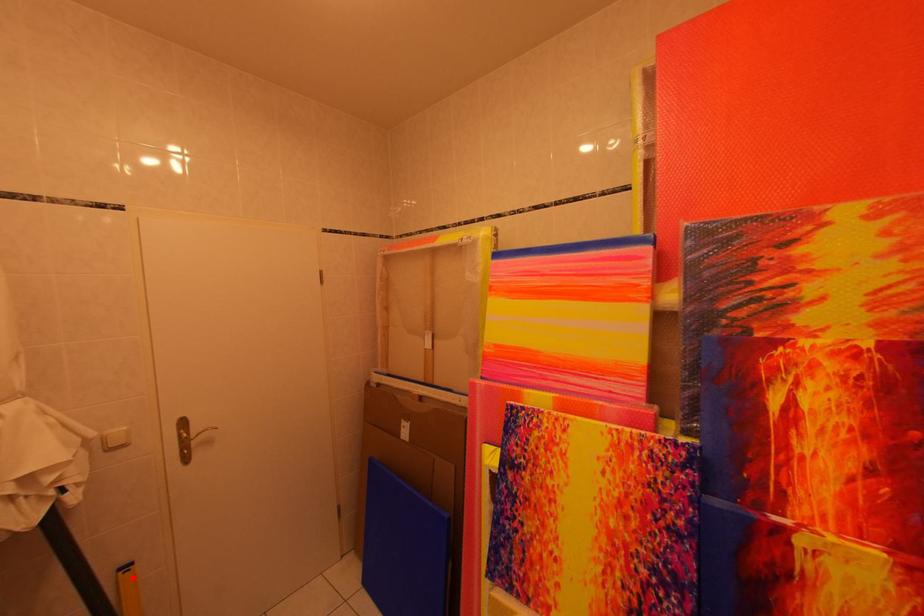
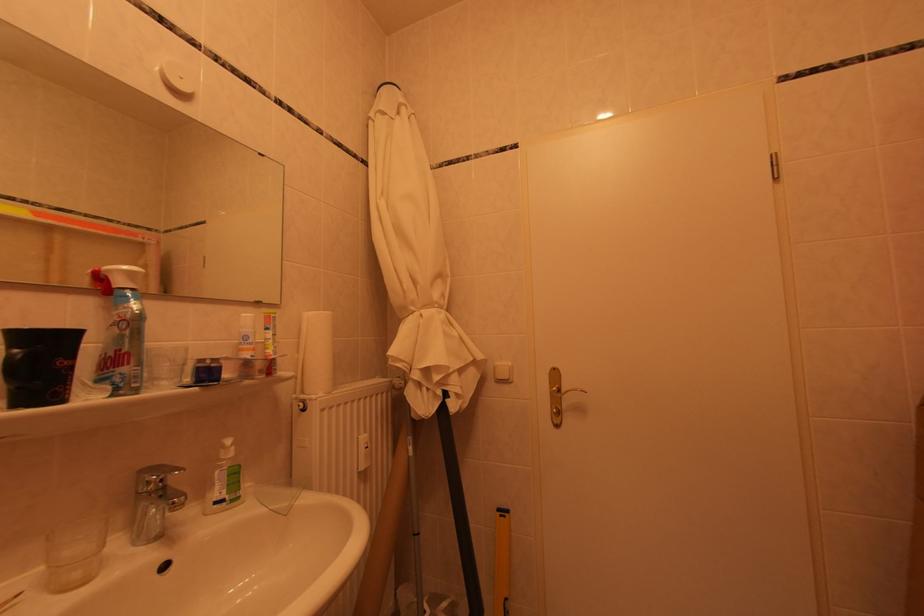
Question: I am providing you with two images of the same scene from different viewpoints. A red point is shown in image1. For the corresponding object point in image2, is it positioned nearer or farther from the camera?

Choices:
 (A) Nearer
 (B) Farther

Answer: (A)